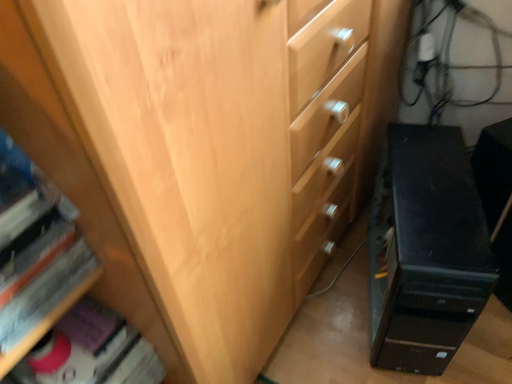
Question: Is black plastic computer tower at lower right bigger than hardcover book at lower left, which appears as the 2th book when viewed from the back?

Choices:
 (A) yes
 (B) no

Answer: (A)

Question: Is black plastic computer tower at lower right at the left side of hardcover book at lower left, which is the second book from bottom to top?

Choices:
 (A) yes
 (B) no

Answer: (B)

Question: Is black plastic computer tower at lower right behind hardcover book at lower left, which appears as the 2th book when viewed from the back?

Choices:
 (A) yes
 (B) no

Answer: (A)

Question: Are black plastic computer tower at lower right and hardcover book at lower left, which appears as the 1th book when viewed from the front, making contact?

Choices:
 (A) yes
 (B) no

Answer: (B)

Question: Is black plastic computer tower at lower right completely or partially outside of hardcover book at lower left, which is the second book from bottom to top?

Choices:
 (A) yes
 (B) no

Answer: (A)

Question: Is black plastic computer tower at lower right closer to camera compared to hardcover book at lower left, the first book viewed from the top?

Choices:
 (A) yes
 (B) no

Answer: (B)

Question: Is matte pink book at lower left, placed as the 1th book when sorted from bottom to top, positioned with its back to hardcover book at lower left, which appears as the 1th book when viewed from the front?

Choices:
 (A) no
 (B) yes

Answer: (A)

Question: Does matte pink book at lower left, the 1th book when ordered from back to front, have a larger size compared to hardcover book at lower left, which appears as the 1th book when viewed from the front?

Choices:
 (A) yes
 (B) no

Answer: (B)

Question: Is the position of matte pink book at lower left, the 1th book when ordered from back to front, less distant than that of hardcover book at lower left, which appears as the 2th book when viewed from the back?

Choices:
 (A) no
 (B) yes

Answer: (A)

Question: From a real-world perspective, is matte pink book at lower left, which is the second book from top to bottom, located higher than hardcover book at lower left, which appears as the 1th book when viewed from the front?

Choices:
 (A) yes
 (B) no

Answer: (B)

Question: Is matte pink book at lower left, which is the second book from top to bottom, next to hardcover book at lower left, which is the second book from bottom to top, and touching it?

Choices:
 (A) no
 (B) yes

Answer: (A)

Question: Considering the relative positions of matte pink book at lower left, arranged as the second book when viewed from the front, and hardcover book at lower left, which is the second book from bottom to top, in the image provided, is matte pink book at lower left, arranged as the second book when viewed from the front, to the right of hardcover book at lower left, which is the second book from bottom to top, from the viewer's perspective?

Choices:
 (A) yes
 (B) no

Answer: (A)

Question: Considering the relative positions of black plastic computer tower at lower right and matte pink book at lower left, which is the second book from top to bottom, in the image provided, is black plastic computer tower at lower right behind matte pink book at lower left, which is the second book from top to bottom,?

Choices:
 (A) yes
 (B) no

Answer: (A)